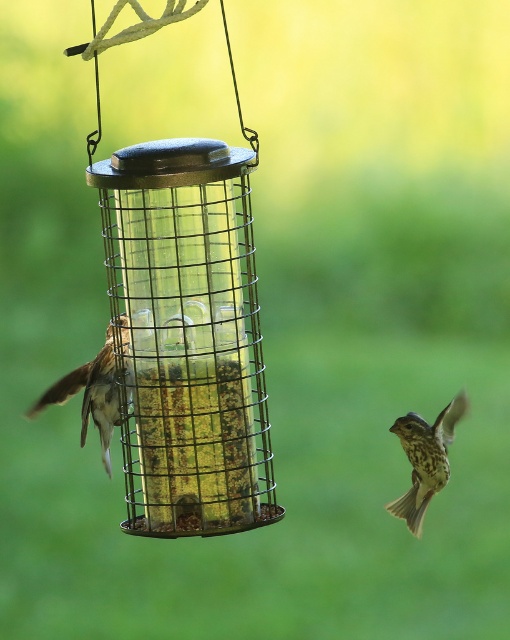
You are a small robot with a 12 inch wide body. You need to move from your current position to the metallic wire mesh bird feeder at left without disturbing the brown speckled sparrow at lower right. Can you safely pass between them?

The metallic wire mesh bird feeder at left and the brown speckled sparrow at lower right are 17.38 inches apart. Since your robot is 12 inches wide, there is enough space between them for you to pass safely without disturbing the sparrow.

You are a birdwatcher observing the scene. You notice the metallic wire mesh bird feeder at left and the brown speckled sparrow at lower right. Which object is positioned more to the left side of the image?

The metallic wire mesh bird feeder at left is positioned more to the left side of the image compared to the brown speckled sparrow at lower right.

In the scene shown: You are a birdwatcher trying to determine the relative sizes of the birds and the feeder. Based on the scene, which object is wider, the metallic wire mesh bird feeder at left or the brown speckled sparrow at lower right?

The metallic wire mesh bird feeder at left is wider than the brown speckled sparrow at lower right according to the description.